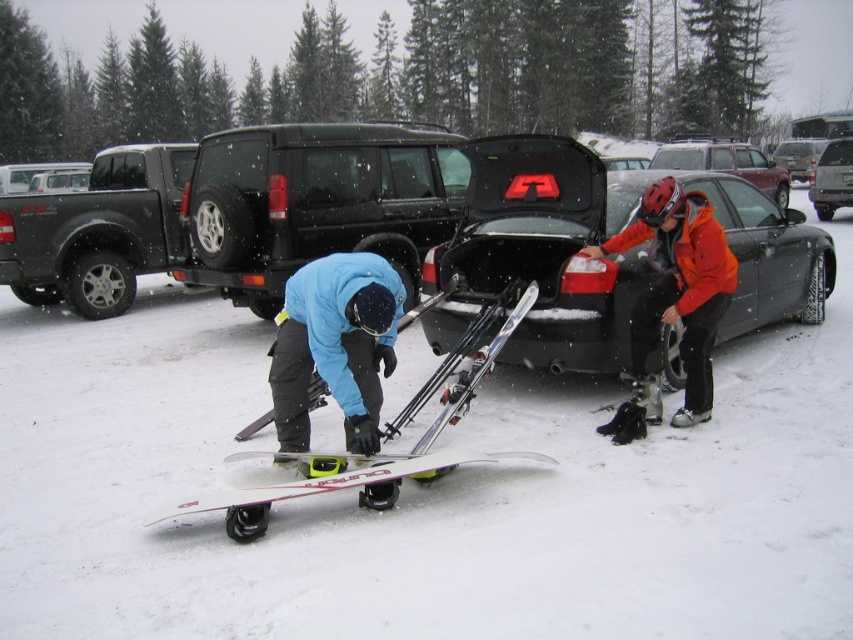
Based on the photo, you are a photographer trying to capture a photo of both the black matte suv at center and the white matte snowboard at lower center in the same frame. Based on their positions, which object should you position closer to the left side of your camera frame?

The black matte suv at center is to the left of the white matte snowboard at lower center, so you should position the black matte suv at center closer to the left side of your camera frame to include both in the shot.

You are standing at the point with coordinates (315, 202) in the snowy parking lot. What object is located exactly at your current position?

The black matte suv at center is located exactly at the point with coordinates (315, 202).

You are standing at point A with coordinates (572, 272). You need to reach point B which is 5.66 meters away. Is there any obstacle between you and point B in the scene?

The scene shows two individuals in a snowy parking lot with snow covered trees around. The person at point A is bending over adjusting skis, while another is near an open trunk of a car to the right. Since the distance between them is 5.66 meters and the area is a parking lot, there are no mentioned obstacles like trees or large objects between them. Therefore, the path is clear.